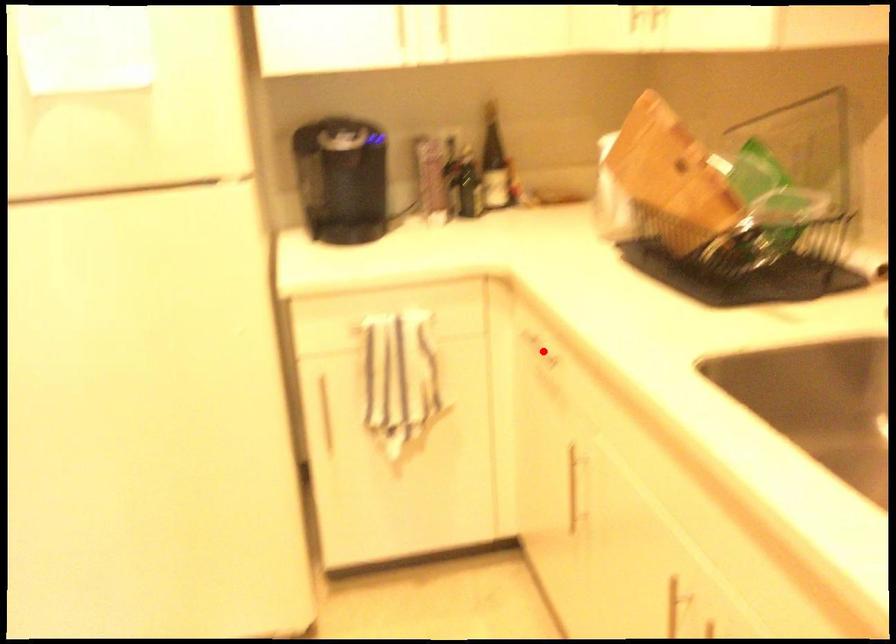
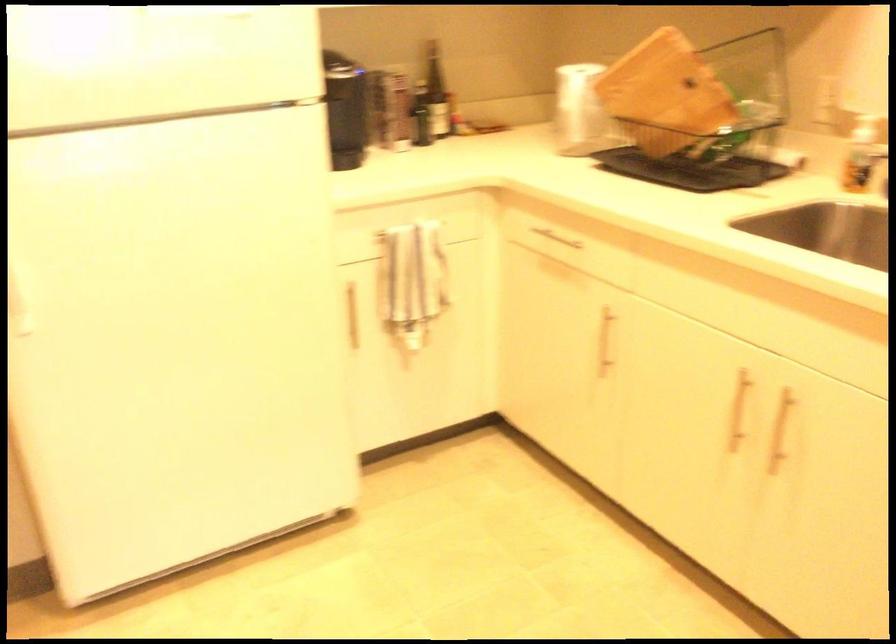
The point at the highlighted location is marked in the first image. Where is the corresponding point in the second image?

(554, 238)